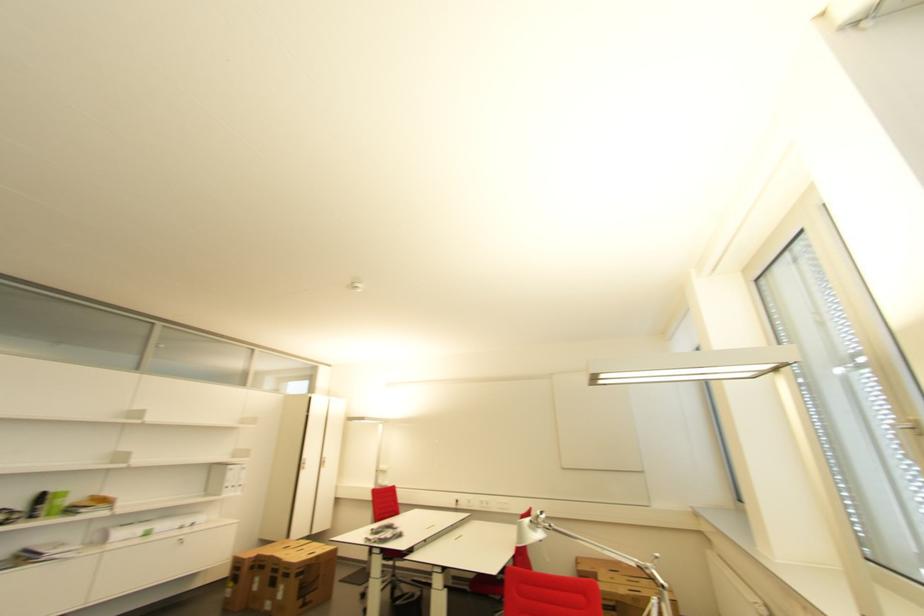
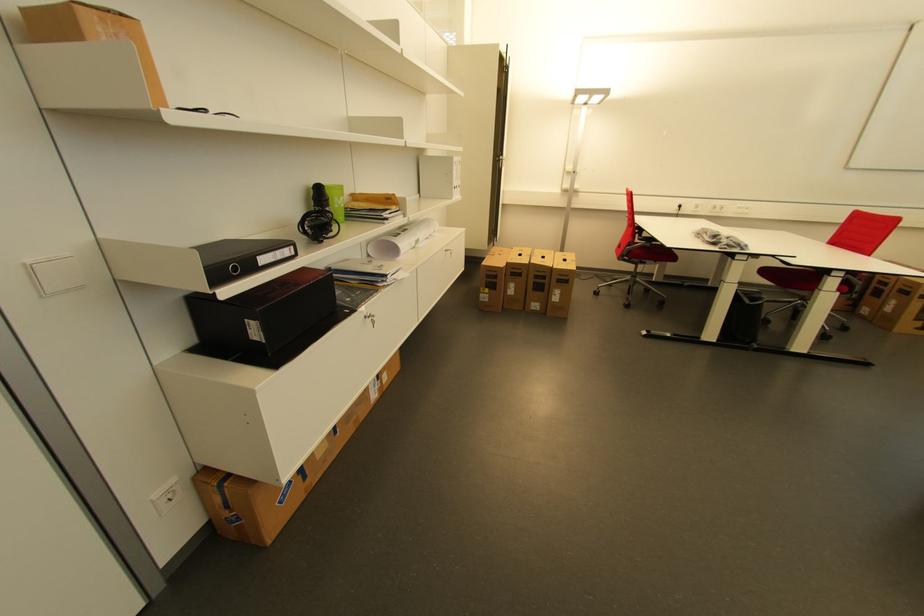
Where in the second image is the point corresponding to (x=282, y=572) from the first image?

(550, 278)